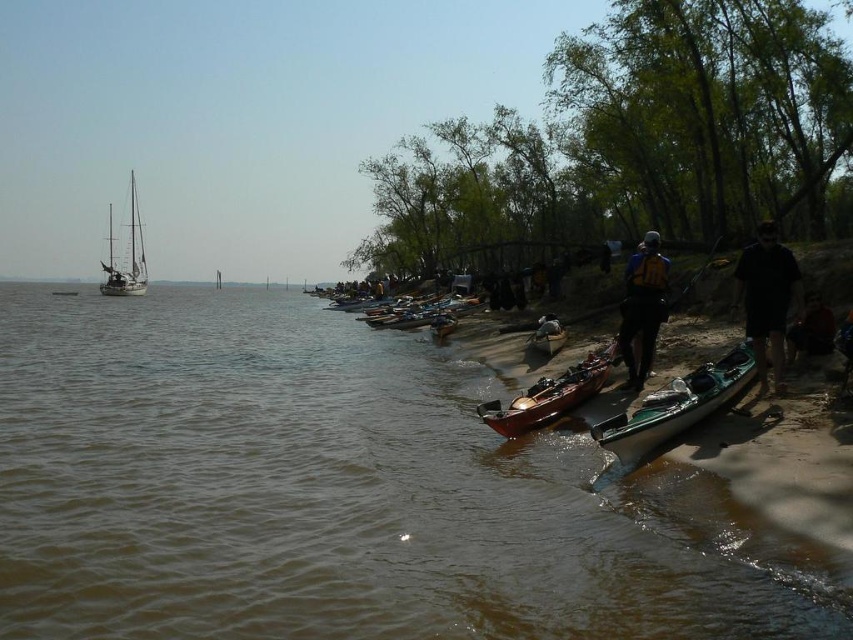
You are a safety inspector at the lakeside and need to check the yellow life vest at center. From your current position, can you reach it within 10 meters without moving?

The yellow life vest at center is 15.25 meters away from the viewer, so you cannot reach it within 10 meters without moving.

You are standing on the sandy shoreline where the kayaks and canoes are lined up. You want to walk to the white wooden sailboat at left. How far will you have to walk in meters?

You will have to walk 97.84 meters to reach the white wooden sailboat at left from the sandy shoreline where the kayaks and canoes are lined up.